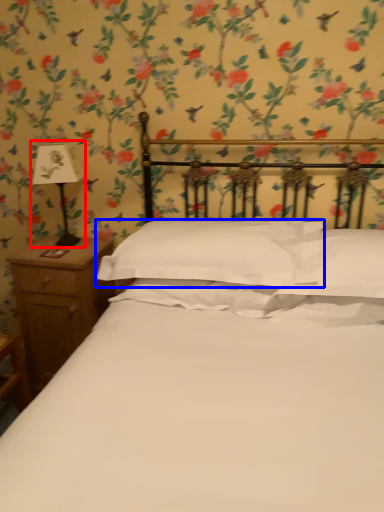
Question: Which object is closer to the camera taking this photo, bedside lamp (highlighted by a red box) or pillow (highlighted by a blue box)?

Choices:
 (A) bedside lamp
 (B) pillow

Answer: (B)